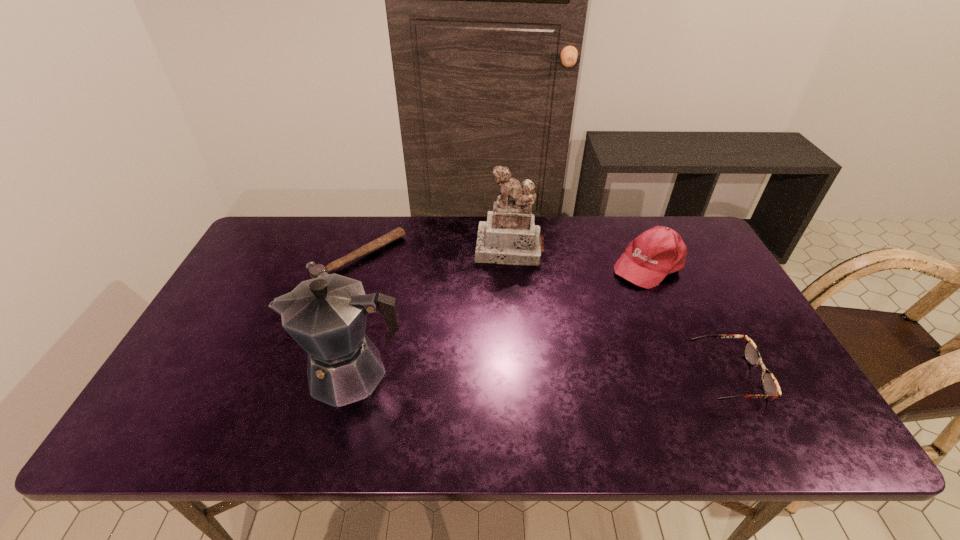
Where is `vacant space on the desktop that is between the coffeepot and the spectacles and is positioned at the front of the baseball cap with the brim`? vacant space on the desktop that is between the coffeepot and the spectacles and is positioned at the front of the baseball cap with the brim is located at coordinates (505, 374).

Find the location of `free space on the desktop that is between the coffeepot and the second shortest object and is positioned on the front-facing side of the third object from left to right`. free space on the desktop that is between the coffeepot and the second shortest object and is positioned on the front-facing side of the third object from left to right is located at coordinates (499, 374).

The height and width of the screenshot is (540, 960). Find the location of `vacant space on the desktop that is between the coffeepot and the second shortest object and is positioned on the striking face of the shortest object`. vacant space on the desktop that is between the coffeepot and the second shortest object and is positioned on the striking face of the shortest object is located at coordinates (493, 374).